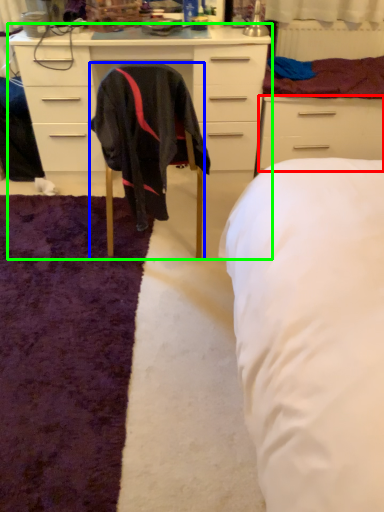
Question: Which is nearer to the drawer (highlighted by a red box)? chair (highlighted by a blue box) or cabinetry (highlighted by a green box).

Choices:
 (A) chair
 (B) cabinetry

Answer: (B)